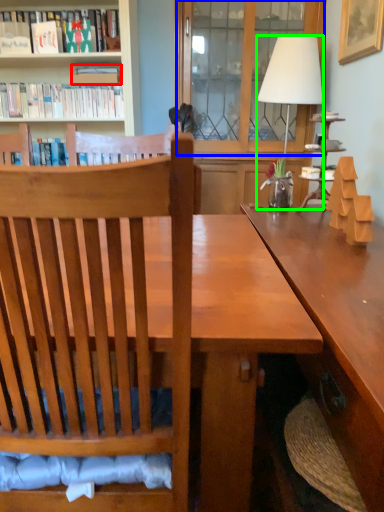
Question: Which object is the farthest from book (highlighted by a red box)? Choose among these: glass door (highlighted by a blue box) or lamp (highlighted by a green box).

Choices:
 (A) glass door
 (B) lamp

Answer: (B)